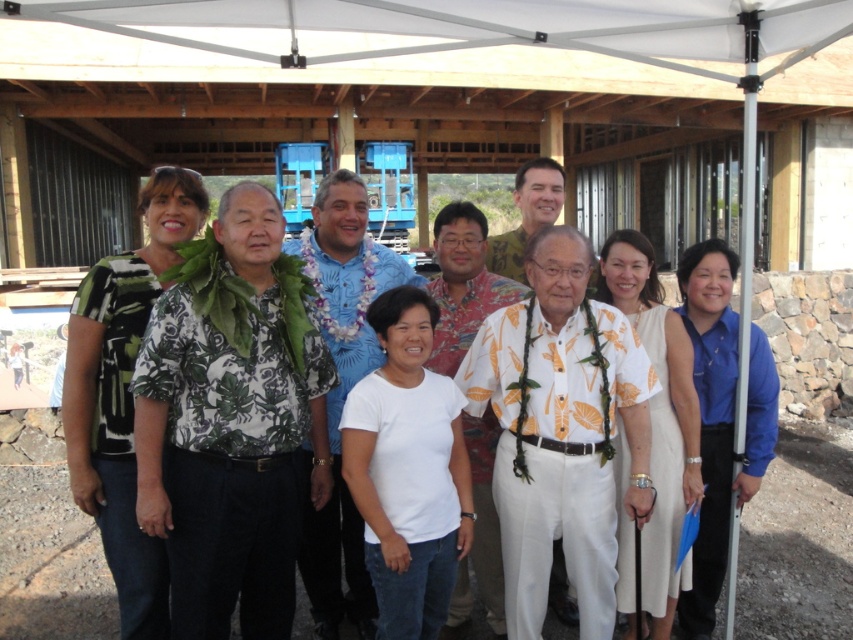
You are standing in front of the white canopy tent where the group is posing. You notice two points marked on the ground at coordinates point (357, 572) and point (340, 305). If you want to place a small flag at the point that is closer to you, which coordinate should you choose?

You should choose point (340, 305) because it is closer to you than point (357, 572), which is further away.

In the scene described, there is a white cotton shirt at center. Can you determine its exact location using coordinates?

The white cotton shirt at center is located at coordinates point (126, 392).